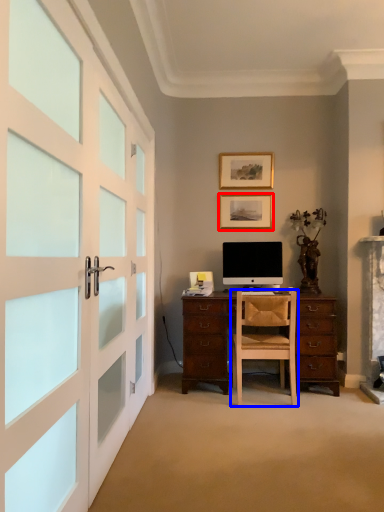
Question: Which point is closer to the camera, picture frame (highlighted by a red box) or chair (highlighted by a blue box)?

Choices:
 (A) picture frame
 (B) chair

Answer: (B)